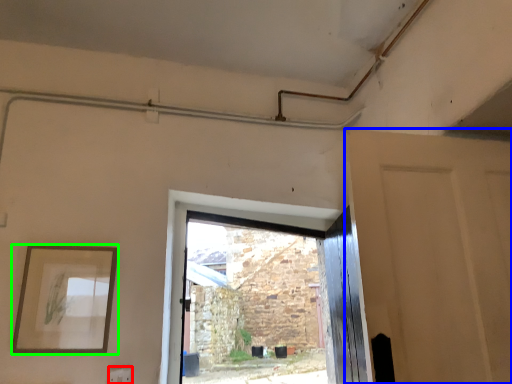
Question: Which is nearer to the electric outlet (highlighted by a red box)? door (highlighted by a blue box) or picture frame (highlighted by a green box).

Choices:
 (A) door
 (B) picture frame

Answer: (B)